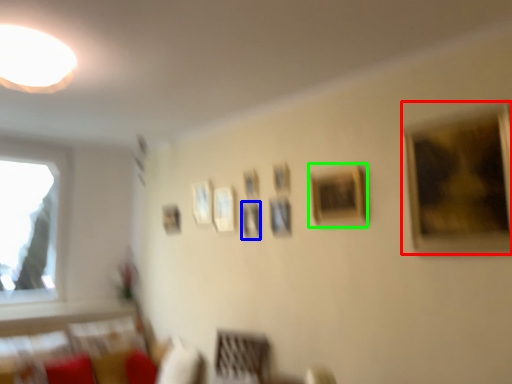
Question: Which object is positioned farthest from picture frame (highlighted by a red box)? Select from picture frame (highlighted by a blue box) and picture frame (highlighted by a green box).

Choices:
 (A) picture frame
 (B) picture frame

Answer: (A)